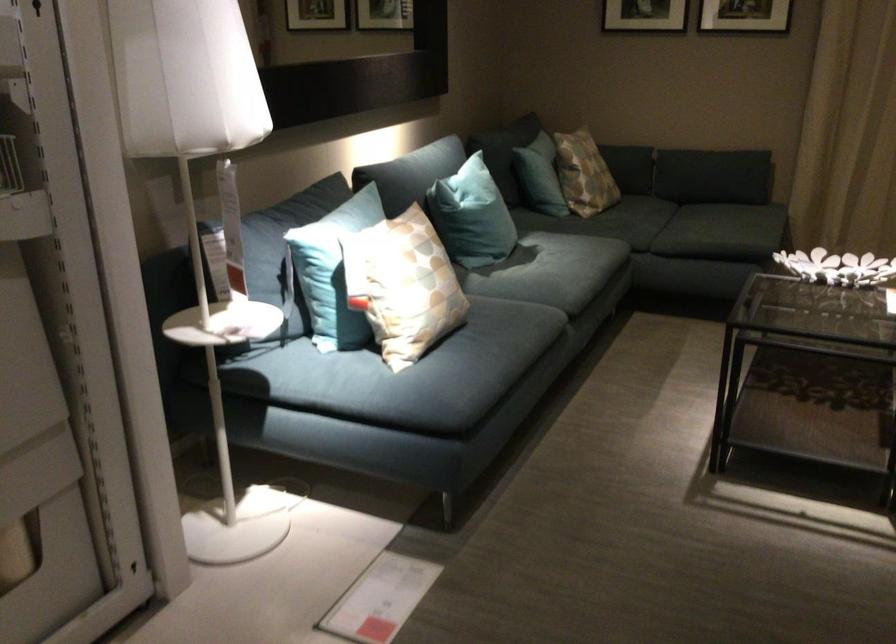
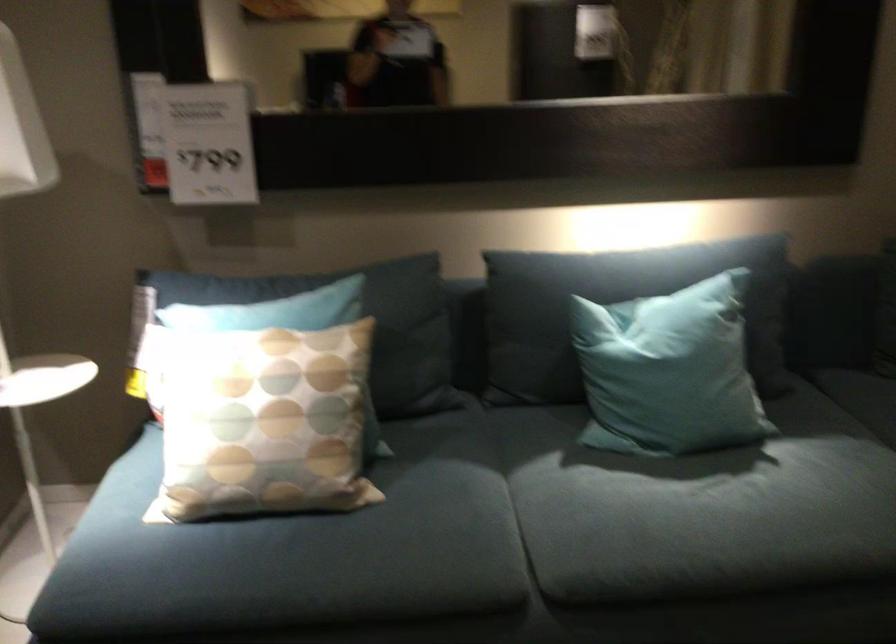
The point at (444,187) is marked in the first image. Where is the corresponding point in the second image?

(616, 308)